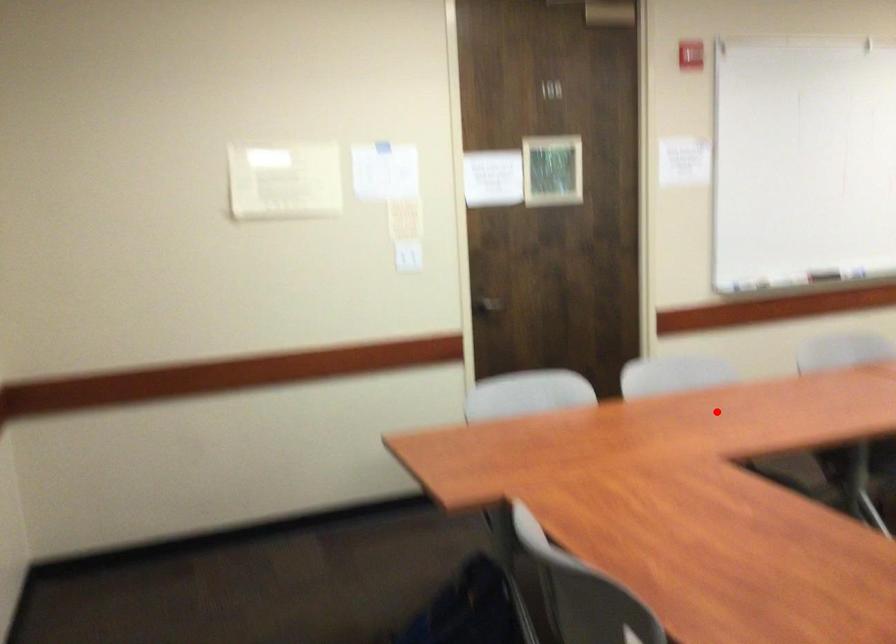
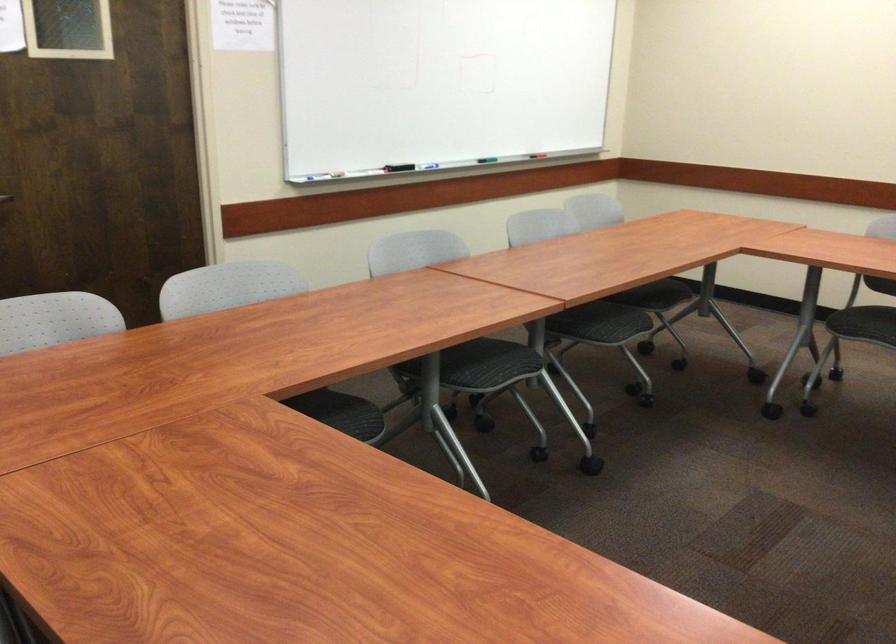
Question: I am providing you with two images of the same scene from different viewpoints. In image1, a red point is highlighted. Considering the same 3D point in image2, which of the following is correct?

Choices:
 (A) It is closer
 (B) It is farther

Answer: (A)